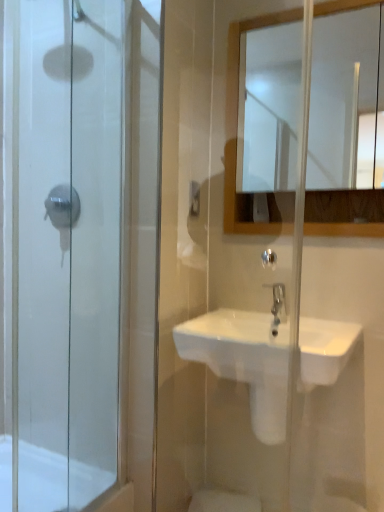
Question: From a real-world perspective, relative to transparent glass shower door at left, is white glossy mirror at upper center vertically above or below?

Choices:
 (A) above
 (B) below

Answer: (A)

Question: Which is correct: white glossy mirror at upper center is inside transparent glass shower door at left, or outside of it?

Choices:
 (A) outside
 (B) inside

Answer: (A)

Question: Estimate the real-world distances between objects in this image. Which object is farther from the satin nickel faucet at center?

Choices:
 (A) white glossy sink at center
 (B) white glossy mirror at upper center
 (C) white glossy bath at lower left
 (D) transparent glass shower door at left

Answer: (B)

Question: Estimate the real-world distances between objects in this image. Which object is farther from the white glossy bath at lower left?

Choices:
 (A) white glossy sink at center
 (B) satin nickel faucet at center
 (C) transparent glass shower door at left
 (D) white glossy mirror at upper center

Answer: (D)